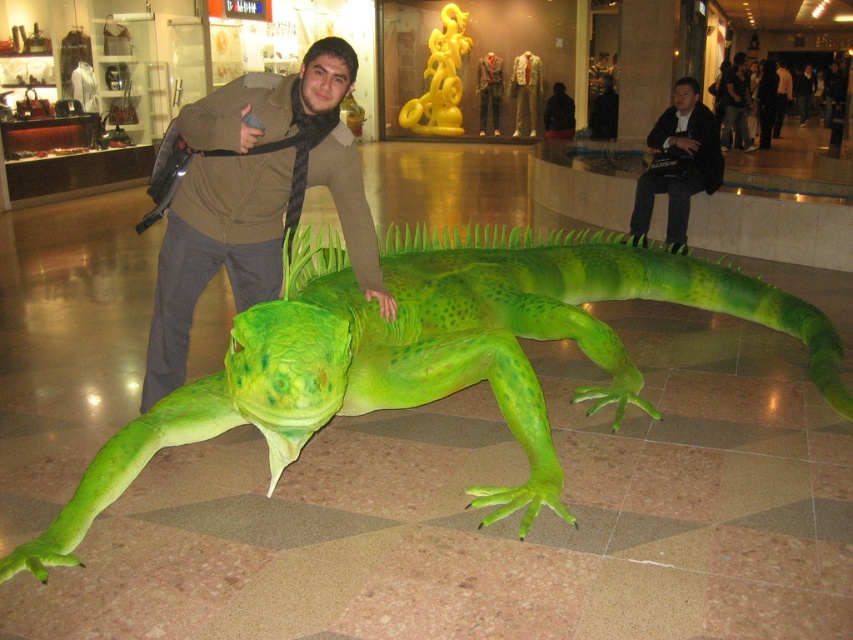
Question: Which object is the closest to the matte gray jacket at center?

Choices:
 (A) matte green suit at center
 (B) black matte jacket at center
 (C) green matte/life-like lizard at center

Answer: (A)

Question: Which point is farther to the camera?

Choices:
 (A) (526, 76)
 (B) (665, 237)

Answer: (A)

Question: Is matte brown jacket at center smaller than matte green suit at center?

Choices:
 (A) no
 (B) yes

Answer: (A)

Question: Can you confirm if matte brown jacket at center is smaller than black matte jacket at center?

Choices:
 (A) no
 (B) yes

Answer: (A)

Question: Among these objects, which one is farthest from the camera?

Choices:
 (A) matte brown jacket at center
 (B) dark gray fabric jacket at center
 (C) green matte/life-like lizard at center

Answer: (B)

Question: Does matte green suit at center appear on the left side of black matte jacket at center?

Choices:
 (A) yes
 (B) no

Answer: (A)